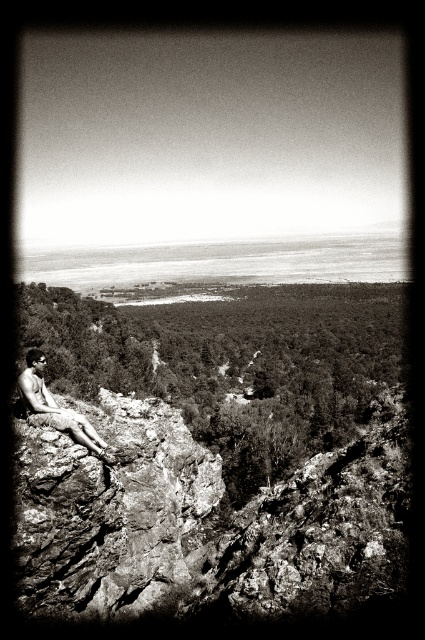
Is rough textured rock at left wider than shiny skin man at lower left?

Incorrect, rough textured rock at left's width does not surpass shiny skin man at lower left's.

Does rough textured rock at left have a greater height compared to shiny skin man at lower left?

Yes, rough textured rock at left is taller than shiny skin man at lower left.

Who is more distant from viewer, (153, 524) or (47, 408)?

Positioned behind is point (153, 524).

Locate an element on the screen. Image resolution: width=425 pixels, height=640 pixels. rough textured rock at left is located at coordinates (108, 508).